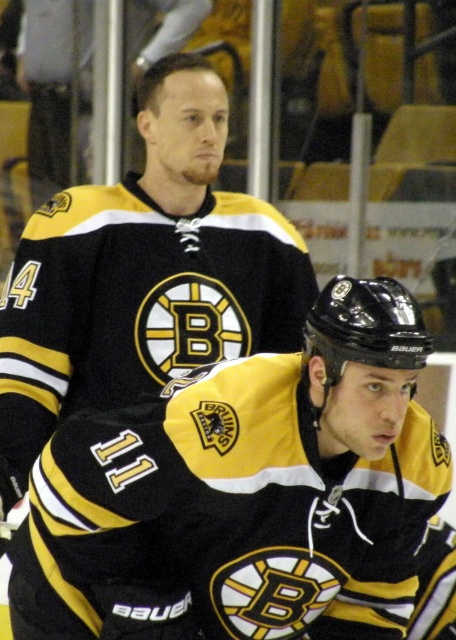
Question: Which point is farther from the camera taking this photo?

Choices:
 (A) (217, 579)
 (B) (17, 364)

Answer: (B)

Question: Does black matte jersey at center appear on the left side of black matte jersey at upper center?

Choices:
 (A) yes
 (B) no

Answer: (B)

Question: Does black matte jersey at center have a lesser width compared to black matte jersey at upper center?

Choices:
 (A) yes
 (B) no

Answer: (A)

Question: Which object appears farthest from the camera in this image?

Choices:
 (A) black matte jersey at center
 (B) black matte jersey at upper center

Answer: (B)

Question: Can you confirm if black matte jersey at center is positioned to the left of black matte jersey at upper center?

Choices:
 (A) no
 (B) yes

Answer: (A)

Question: Among these objects, which one is farthest from the camera?

Choices:
 (A) black matte jersey at center
 (B) black matte jersey at upper center

Answer: (B)